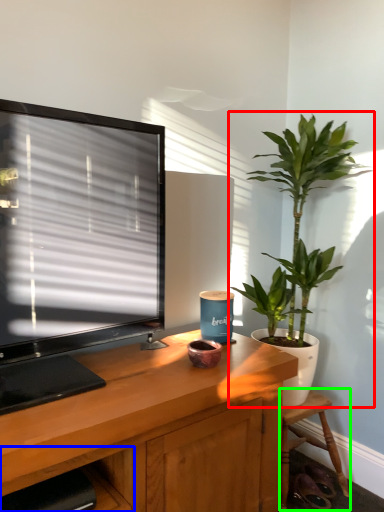
Question: Estimate the real-world distances between objects in this image. Which object is closer to houseplant (highlighted by a red box), shelf (highlighted by a blue box) or chair (highlighted by a green box)?

Choices:
 (A) shelf
 (B) chair

Answer: (B)